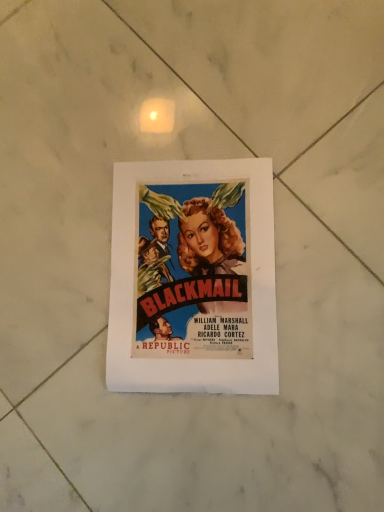
This screenshot has width=384, height=512. I want to click on unoccupied area in front of matte paper poster at center, so click(279, 419).